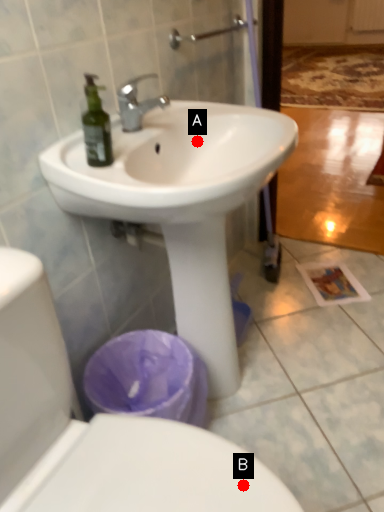
Question: Two points are circled on the image, labeled by A and B beside each circle. Which point appears farthest from the camera in this image?

Choices:
 (A) A is further
 (B) B is further

Answer: (A)